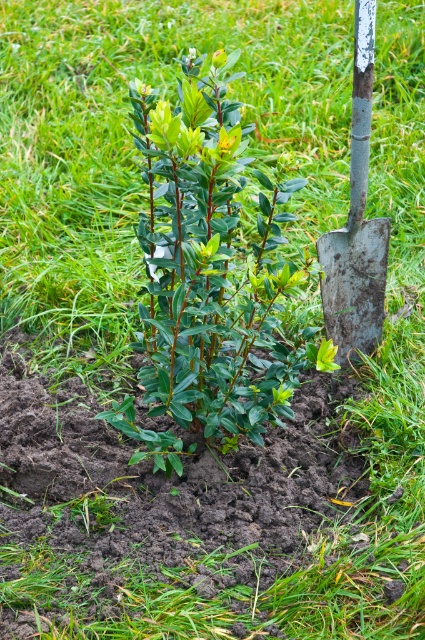
Question: Which point is closer to the camera?

Choices:
 (A) (354, 97)
 (B) (173, 380)

Answer: (B)

Question: Can you confirm if green glossy bush at center is wider than rusty metal shovel at right?

Choices:
 (A) no
 (B) yes

Answer: (B)

Question: Can you confirm if green glossy bush at center is positioned above rusty metal shovel at right?

Choices:
 (A) yes
 (B) no

Answer: (B)

Question: Among these objects, which one is farthest from the camera?

Choices:
 (A) rusty metal shovel at right
 (B) green glossy bush at center

Answer: (A)

Question: Which point is closer to the camera?

Choices:
 (A) rusty metal shovel at right
 (B) green glossy bush at center

Answer: (B)

Question: Is green glossy bush at center to the left of rusty metal shovel at right from the viewer's perspective?

Choices:
 (A) yes
 (B) no

Answer: (A)